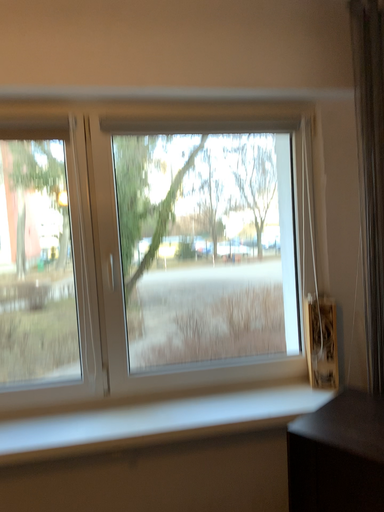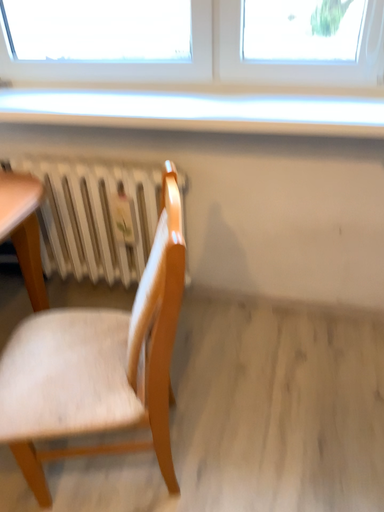
Question: How did the camera likely rotate when shooting the video?

Choices:
 (A) rotated upward
 (B) rotated downward

Answer: (B)